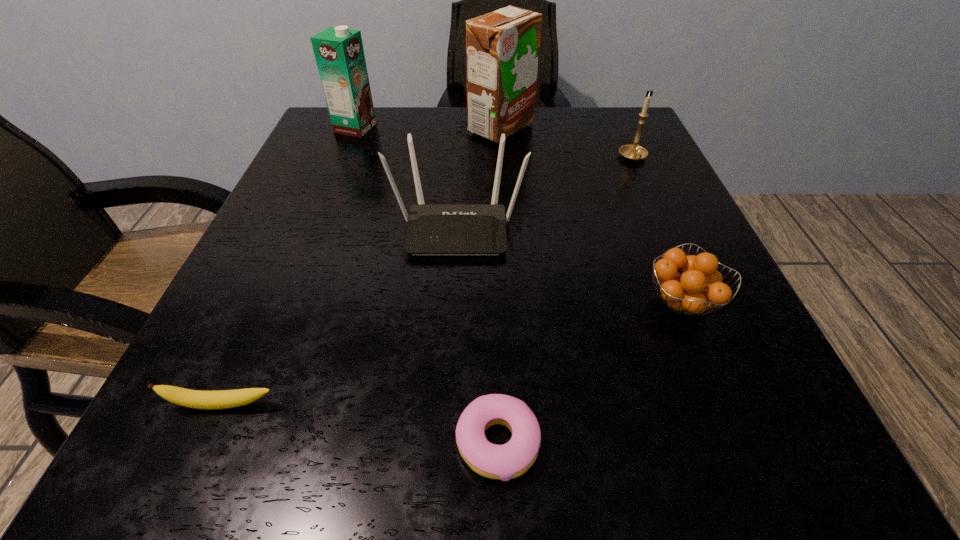
The width and height of the screenshot is (960, 540). Find the location of `vacant area located on the straw side of the right carton`. vacant area located on the straw side of the right carton is located at coordinates (379, 129).

Where is `free point located 0.090m on the right of the left carton`? The height and width of the screenshot is (540, 960). free point located 0.090m on the right of the left carton is located at coordinates (415, 128).

This screenshot has width=960, height=540. Identify the location of free region located 0.270m on the handle side of the fifth nearest object. (680, 261).

Where is `free space located 0.140m on the front-facing side of the router`? free space located 0.140m on the front-facing side of the router is located at coordinates [x=452, y=330].

I want to click on vacant space located on the left of the fifth tallest object, so click(588, 303).

Identify the location of free spot located 0.070m on the upward curve of the second shortest object. (193, 474).

Identify the location of vacant space located on the left of the shortest object. This screenshot has width=960, height=540. (190, 442).

The width and height of the screenshot is (960, 540). I want to click on candle holder positioned at the far edge, so click(x=633, y=152).

Find the location of a particular element. banana situated at the near edge is located at coordinates (209, 400).

This screenshot has width=960, height=540. In order to click on doughnut that is at the near edge in this screenshot , I will do `click(504, 462)`.